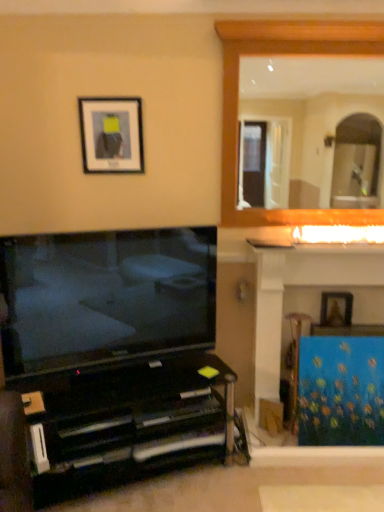
Locate an element on the screen. free spot above wooden frame at upper right (from a real-world perspective) is located at coordinates (314, 17).